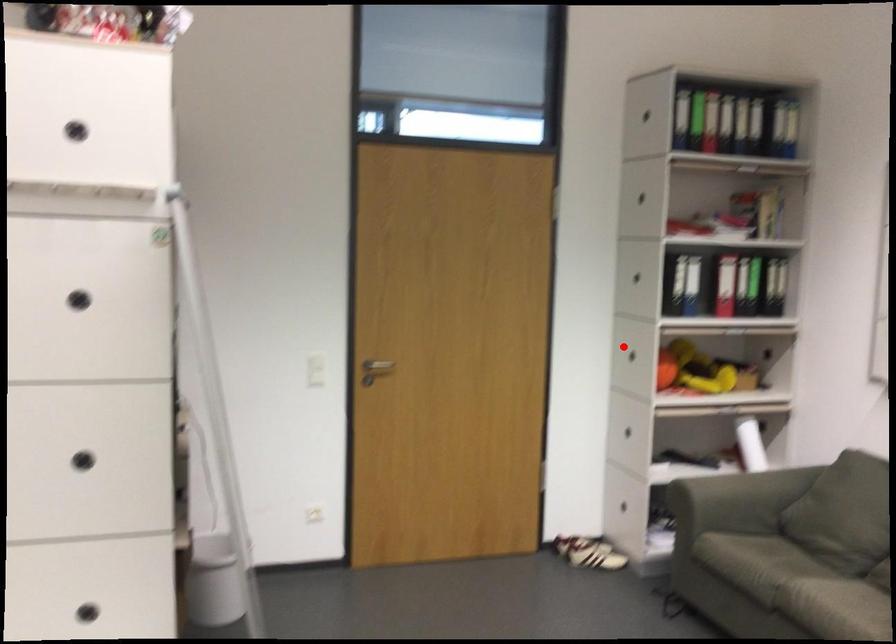
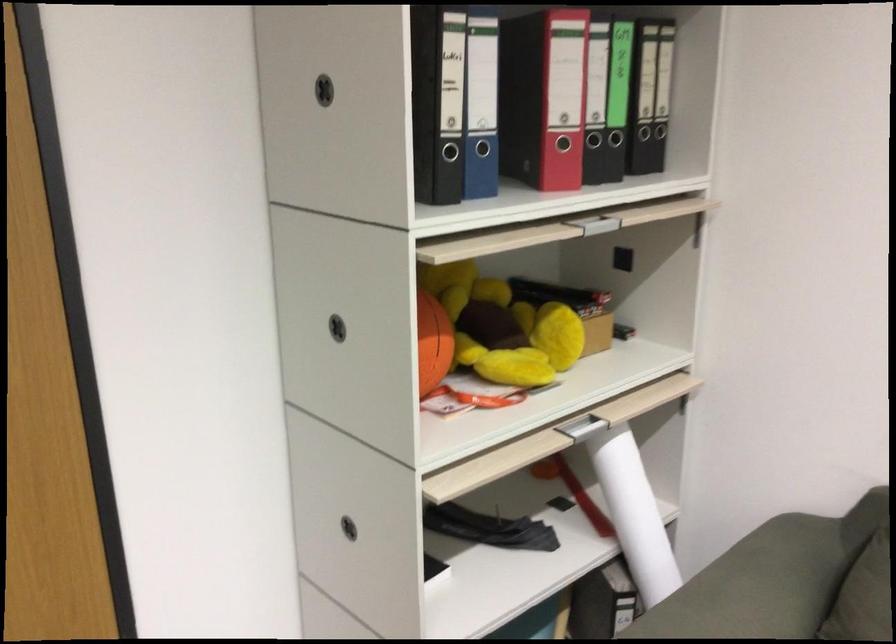
In the second image, find the point that corresponds to the highlighted location in the first image.

(337, 328)